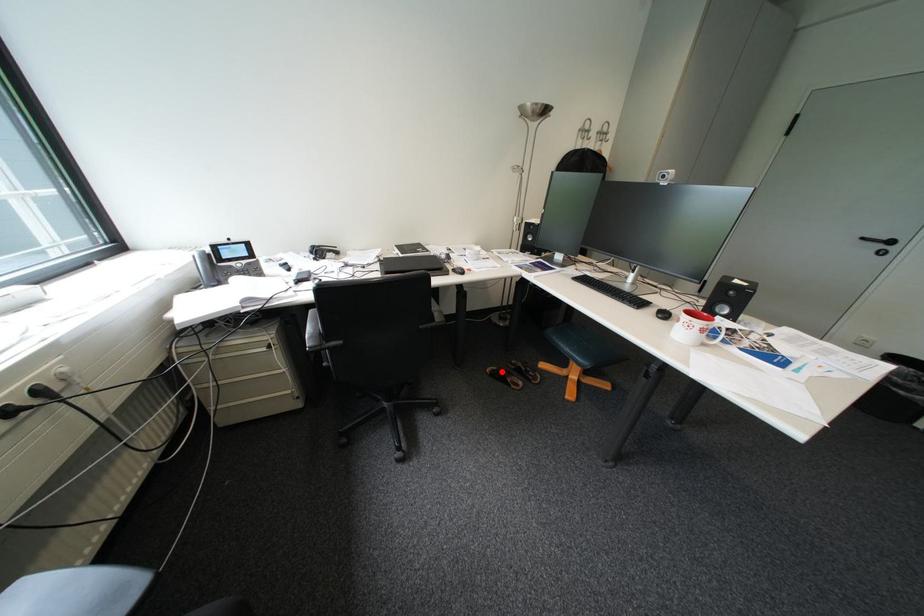
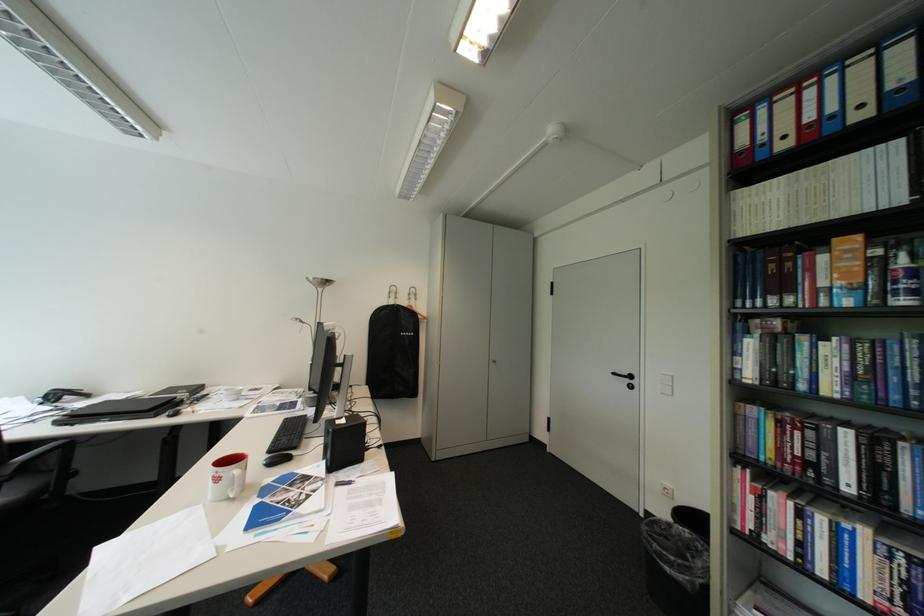
Question: I am providing you with two images of the same scene from different viewpoints. A red point is marked on the first image. Is the red point's position out of view in image 2?

Choices:
 (A) Yes
 (B) No

Answer: (A)